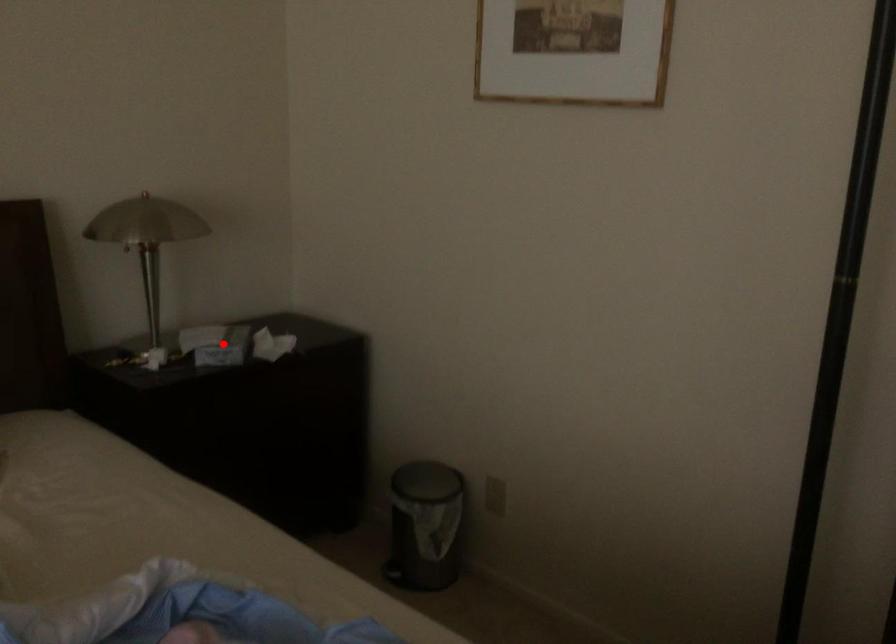
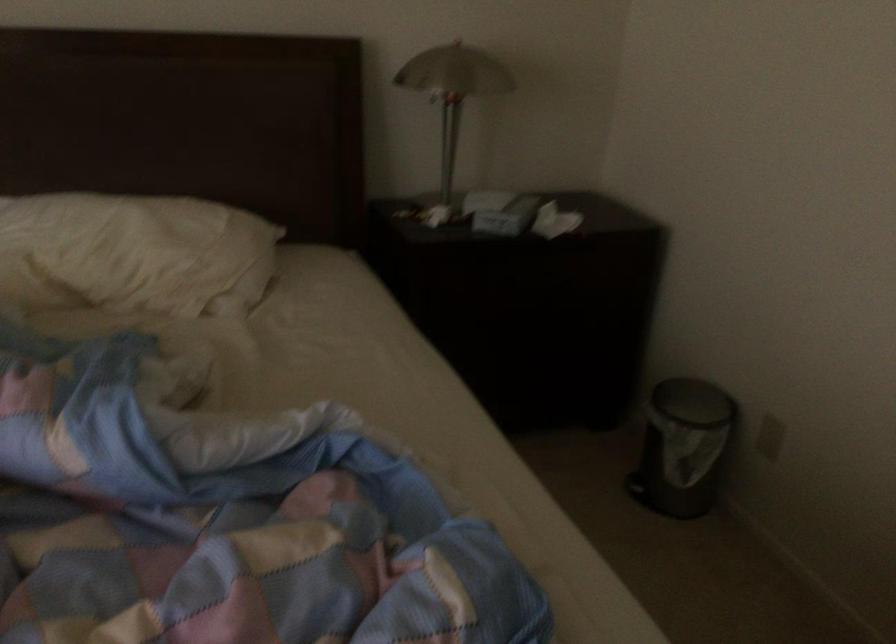
Locate, in the second image, the point that corresponds to the highlighted location in the first image.

(501, 212)